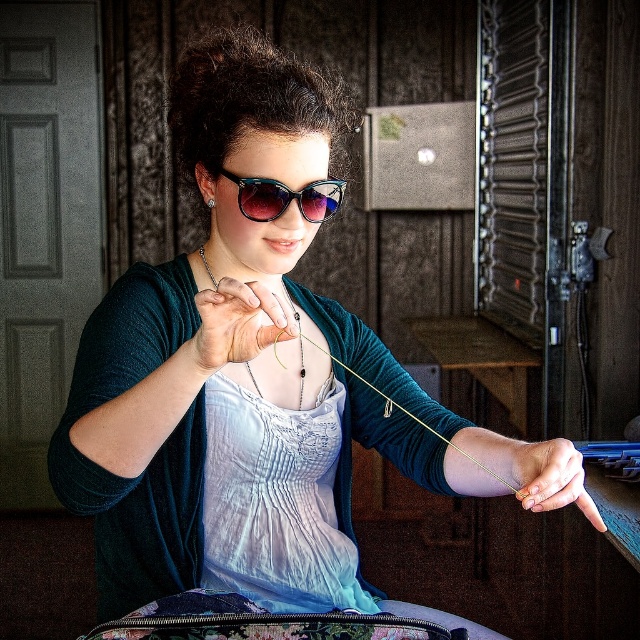
You are a photographer wanting to take a closeup shot of the person crafting. The camera is 3.31 feet away from the white cotton apron at center. Is the distance sufficient to avoid blurring the apron in the photo?

The camera is 3.31 feet away from the white cotton apron at center, so the distance is sufficient to avoid blurring the apron in the photo.

You are a jeweler who needs to place a new piece of jewelry on the workbench. The workbench is located at point (237, 323). There is already an object at that location. What is it?

The object at point (237, 323) is a matte silver ring at center.